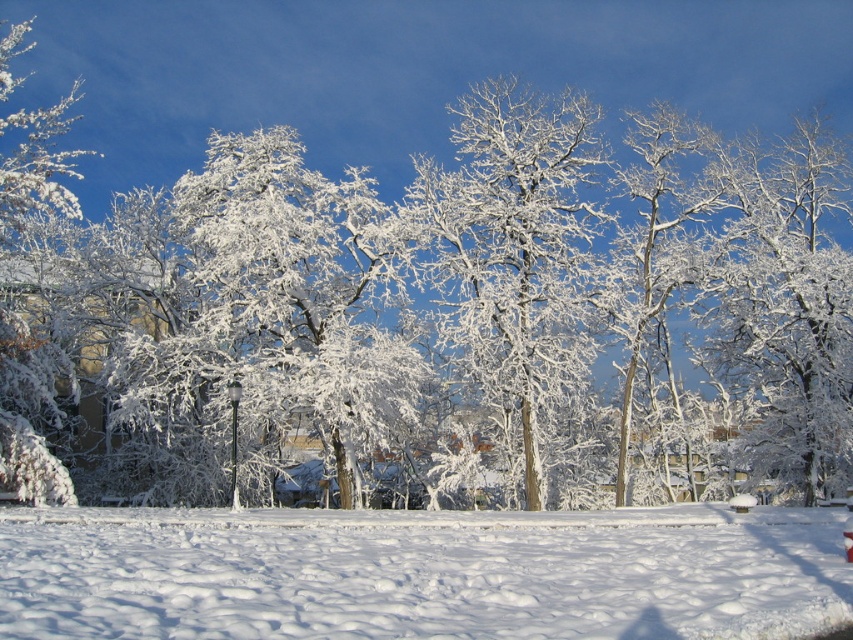
Can you confirm if white fluffy snow at lower center is thinner than white frosty tree at upper right?

Incorrect, white fluffy snow at lower center's width is not less than white frosty tree at upper right's.

Does white fluffy snow at lower center appear under white frosty tree at upper right?

Yes, white fluffy snow at lower center is below white frosty tree at upper right.

Identify the location of white fluffy snow at lower center. (421, 572).

Can you confirm if white frosty tree at center is positioned to the right of white frosty tree at upper right?

In fact, white frosty tree at center is to the left of white frosty tree at upper right.

Which is more to the right, white frosty tree at center or white frosty tree at upper right?

Positioned to the right is white frosty tree at upper right.

The image size is (853, 640). I want to click on white frosty tree at center, so click(x=514, y=252).

The height and width of the screenshot is (640, 853). What are the coordinates of `white frosty tree at center` in the screenshot? It's located at (514, 252).

Which is behind, point (409, 550) or point (474, 141)?

Point (474, 141)

Between point (590, 524) and point (583, 237), which one is positioned behind?

Point (583, 237)

The image size is (853, 640). Identify the location of white fluffy snow at lower center. (421, 572).